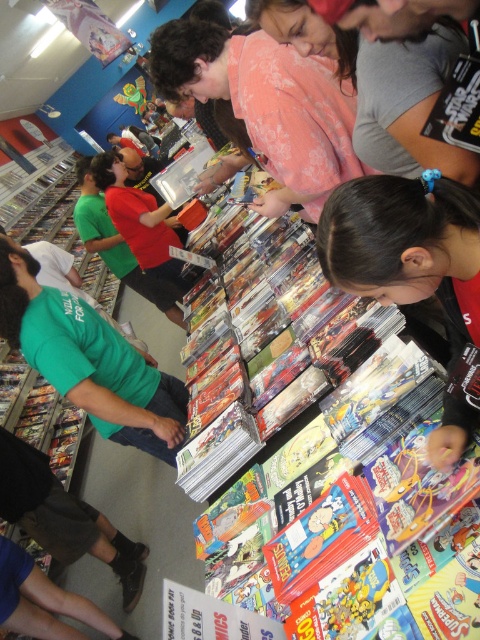
Can you confirm if green t-shirt at left is smaller than plush yellow toy at center?

Incorrect, green t-shirt at left is not smaller in size than plush yellow toy at center.

Who is taller, green t-shirt at left or plush yellow toy at center?

Standing taller between the two is green t-shirt at left.

In order to click on green t-shirt at left in this screenshot , I will do `click(90, 360)`.

Between black matte hair at center and plush yellow toy at center, which one has more height?

plush yellow toy at center

Locate an element on the screen. The height and width of the screenshot is (640, 480). black matte hair at center is located at coordinates (415, 273).

Between point (466, 352) and point (132, 84), which one is positioned in front?

Point (466, 352)

This screenshot has height=640, width=480. Identify the location of black matte hair at center. (415, 273).

Does black matte hair at center appear under green t-shirt at left?

No, black matte hair at center is not below green t-shirt at left.

Between black matte hair at center and green t-shirt at left, which one has less height?

black matte hair at center

Where is `black matte hair at center`? The image size is (480, 640). black matte hair at center is located at coordinates (415, 273).